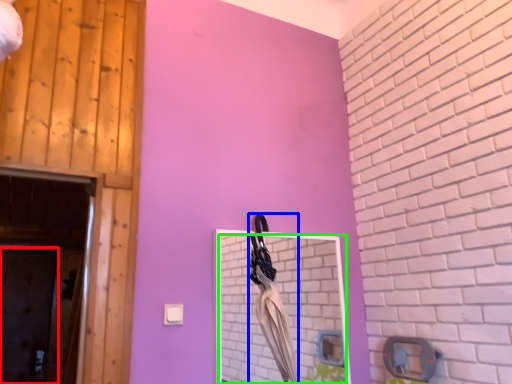
Question: Based on their relative distances, which object is farther from door (highlighted by a red box)? Choose from laundry (highlighted by a blue box) and mirror (highlighted by a green box).

Choices:
 (A) laundry
 (B) mirror

Answer: (A)